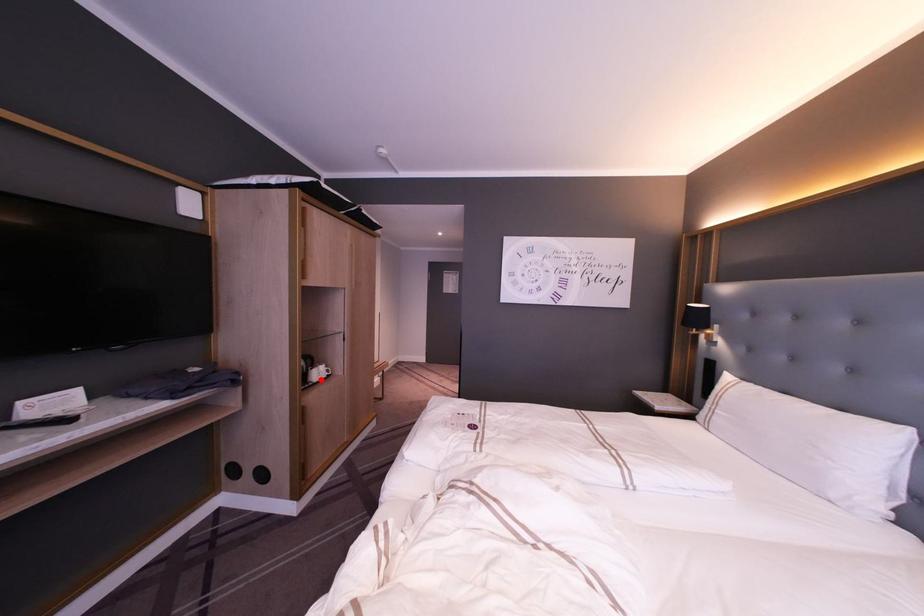
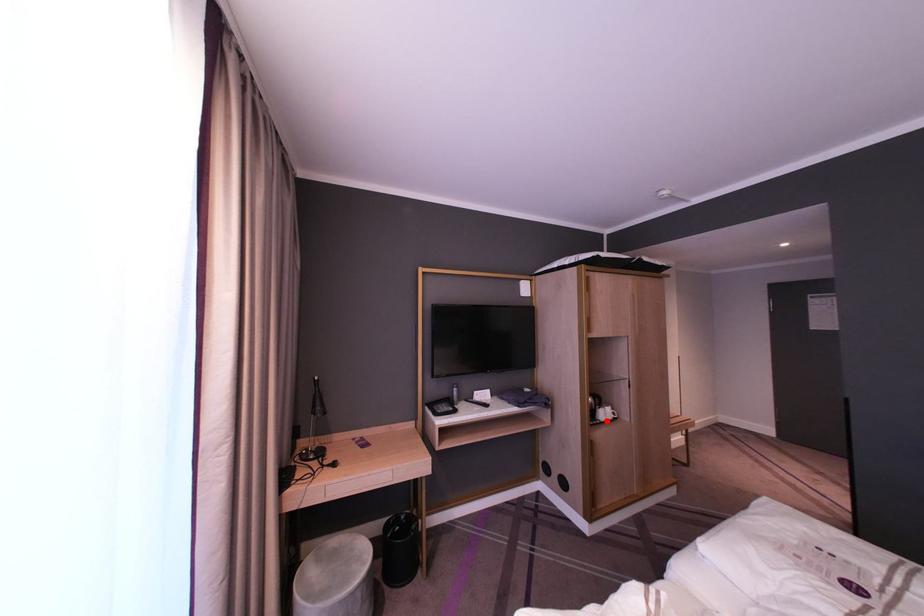
I am providing you with two images of the same scene from different viewpoints. A red point is marked on the first image and another point is marked on the second image. Do the highlighted points in image1 and image2 indicate the same real-world spot?

Yes